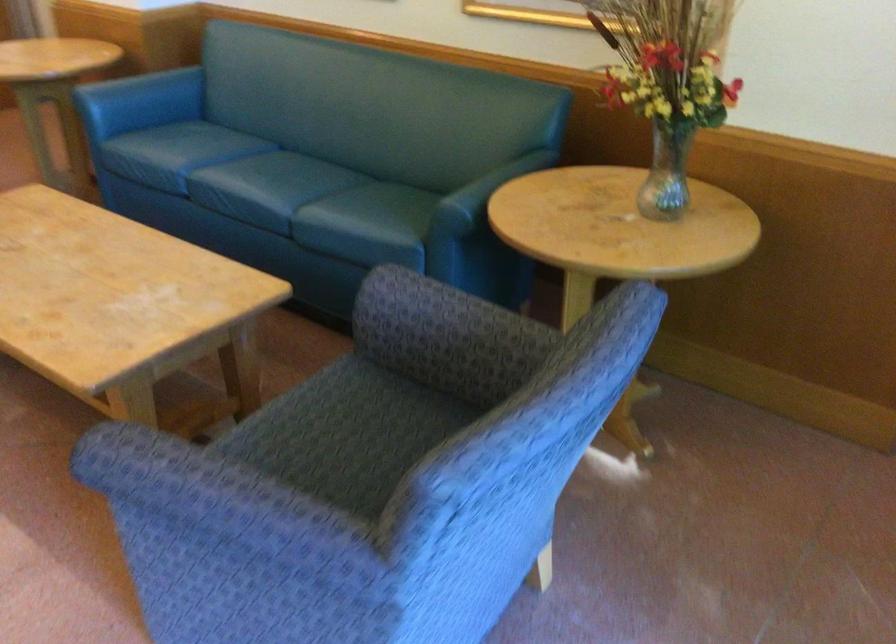
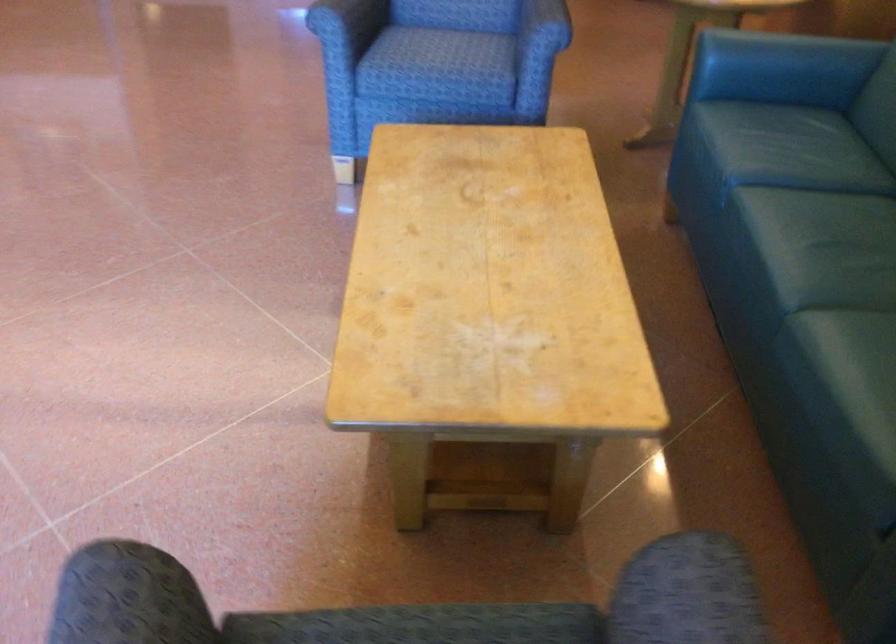
In the second image, find the point that corresponds to pixel 194 144 in the first image.

(776, 147)